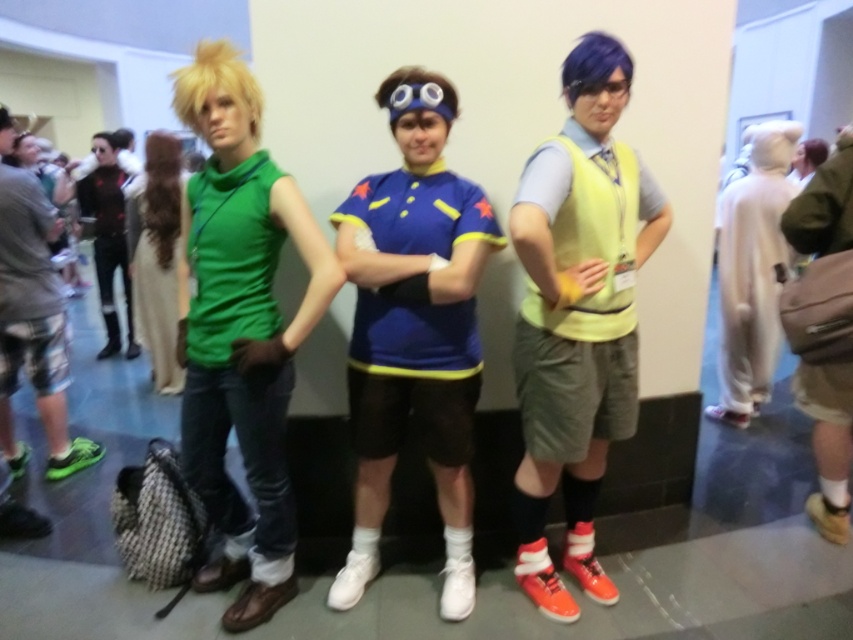
You are a photographer setting up a shoot in the hallway. You need to position a 1.2 meter wide backdrop between the yellow fabric vest at center and the brushed metal backpack at left. Will the backdrop fit between them?

The yellow fabric vest at center is wider than the brushed metal backpack at left. However, the question is about the distance between them, not their widths. The provided description only states the vest is wider, not the spacing between objects. Therefore, there isn not enough information to determine if the backdrop will fit.

You are a photographer trying to capture a clear shot of the matte green turtleneck at center without the brushed metal backpack at left reflecting in the camera lens. Based on their positions, is the backpack likely to obstruct your view of the turtleneck?

The brushed metal backpack at left is in front of the matte green turtleneck at center, so it would obstruct the view of the turtleneck unless moved or repositioned.

You are a photographer trying to capture a group photo of the brushed metal backpack at left and the matte green turtleneck at center. The camera you have can only focus on objects within 30 inches of each other. Will both items be in focus?

The brushed metal backpack at left and matte green turtleneck at center are 34.02 inches apart, which exceeds the camera focus range of 30 inches. Therefore, both items cannot be in focus simultaneously.